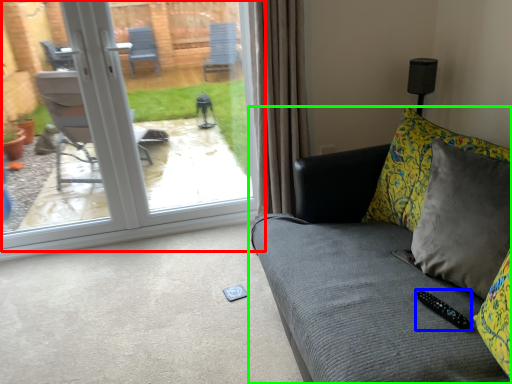
Question: Based on their relative distances, which object is nearer to door (highlighted by a red box)? Choose from remote (highlighted by a blue box) and studio couch (highlighted by a green box).

Choices:
 (A) remote
 (B) studio couch

Answer: (B)